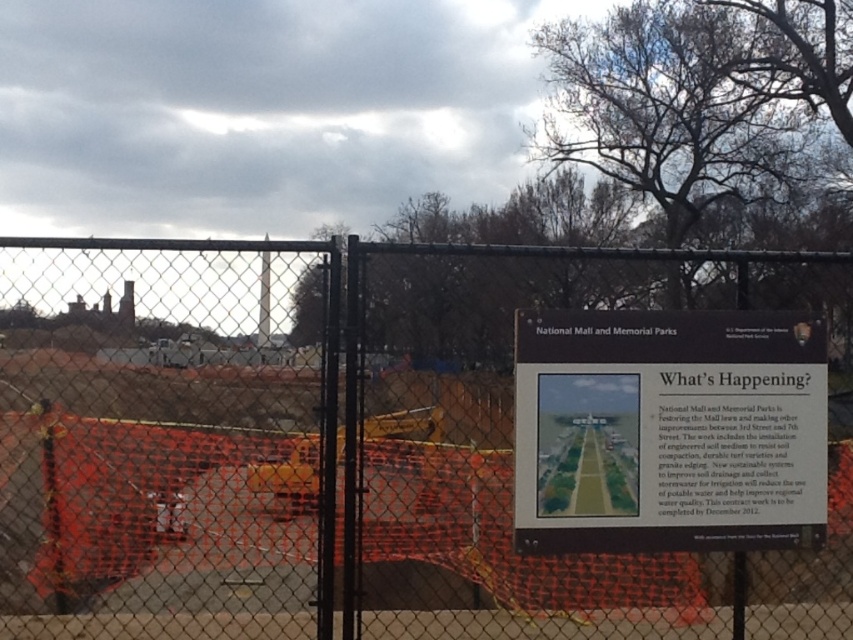
Is point (468, 577) positioned behind point (521, 545)?

That is True.

Is point (389, 561) in front of point (598, 394)?

No, it is behind (598, 394).

This screenshot has height=640, width=853. What do you see at coordinates (172, 508) in the screenshot? I see `orange mesh fence at left` at bounding box center [172, 508].

Identify the location of orange mesh fence at left. (172, 508).

Does metal chain-link fence at center appear on the left side of orange mesh fence at left?

Indeed, metal chain-link fence at center is positioned on the left side of orange mesh fence at left.

Which is in front, point (363, 326) or point (556, 611)?

Point (363, 326) is more forward.

Is point (555, 392) closer to camera compared to point (51, 582)?

Yes, it is.

Find the location of `metal chain-link fence at center`. metal chain-link fence at center is located at coordinates (402, 458).

Is metal chain-link fence at center smaller than wooden signboard at center?

No, metal chain-link fence at center is not smaller than wooden signboard at center.

Does metal chain-link fence at center have a greater height compared to wooden signboard at center?

Indeed, metal chain-link fence at center has a greater height compared to wooden signboard at center.

The height and width of the screenshot is (640, 853). Find the location of `metal chain-link fence at center`. metal chain-link fence at center is located at coordinates (402, 458).

Locate an element on the screen. metal chain-link fence at center is located at coordinates (402, 458).